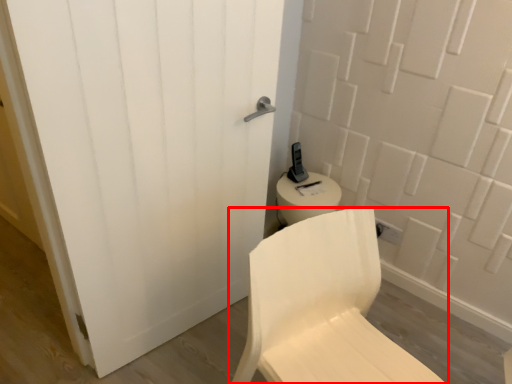
Question: In this image, where is chair (annotated by the red box) located relative to door?

Choices:
 (A) right
 (B) left

Answer: (A)